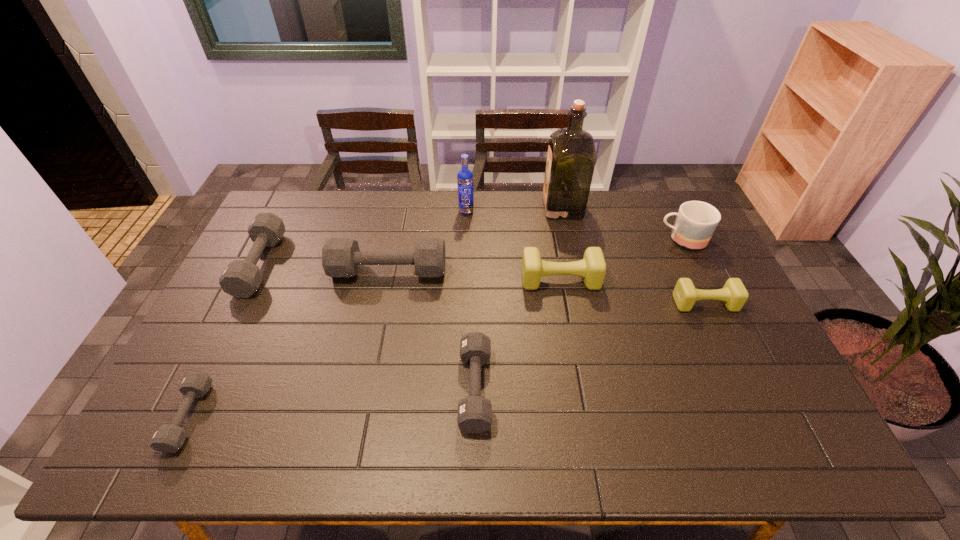
In order to click on the third dumbbell from right to left in this screenshot , I will do pos(474,415).

In order to click on the nearer olive dumbbell in this screenshot , I will do `click(734, 295)`.

Image resolution: width=960 pixels, height=540 pixels. I want to click on the rightmost dumbbell, so click(x=734, y=295).

Locate an element on the screen. This screenshot has height=540, width=960. the shortest dumbbell is located at coordinates (168, 438).

Identify the location of the shortest object. This screenshot has height=540, width=960. (168, 438).

The width and height of the screenshot is (960, 540). I want to click on blank space located 0.070m on the label of the tallest object, so click(525, 207).

Where is `free region located on the label of the tallest object`? free region located on the label of the tallest object is located at coordinates (519, 207).

At what (x,y) coordinates should I click in order to perform the action: click on vacant area located 0.350m on the label of the tallest object. Please return your answer as a coordinate pair (x, y). The height and width of the screenshot is (540, 960). Looking at the image, I should click on (449, 207).

At what (x,y) coordinates should I click in order to perform the action: click on vacant area located on the left of the vodka. Please return your answer as a coordinate pair (x, y). Image resolution: width=960 pixels, height=540 pixels. Looking at the image, I should click on (383, 211).

Find the location of a particular element. The height and width of the screenshot is (540, 960). free space located 0.320m on the front of the second gray dumbbell from right to left is located at coordinates (368, 375).